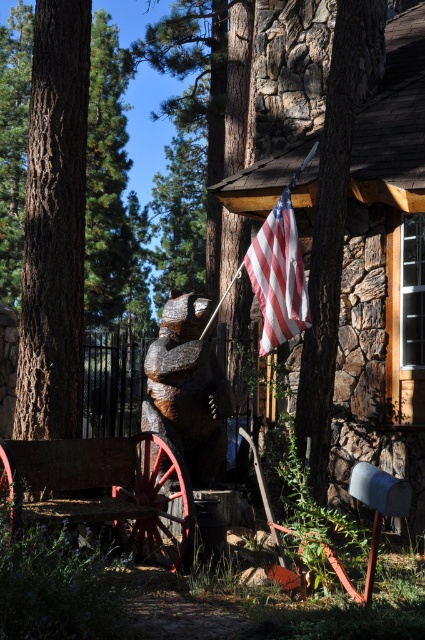
Which of these two, rustic wood wagon at center or wooden bear at center, stands taller?

With more height is wooden bear at center.

Is rustic wood wagon at center shorter than wooden bear at center?

Yes.

This screenshot has height=640, width=425. I want to click on rustic wood wagon at center, so click(x=112, y=490).

Which is above, stone cabin at upper right or rustic wood wagon at center?

Positioned higher is stone cabin at upper right.

Does stone cabin at upper right come in front of rustic wood wagon at center?

No.

Who is more distant from viewer, (385, 132) or (59, 458)?

Point (385, 132)

At what (x,y) coordinates should I click in order to perform the action: click on stone cabin at upper right. Please return your answer as a coordinate pair (x, y). The width and height of the screenshot is (425, 640). Looking at the image, I should click on (385, 282).

Is stone cabin at upper right taller than american flag at upper center?

No.

Which is above, stone cabin at upper right or american flag at upper center?

stone cabin at upper right is higher up.

Which is behind, point (280, 81) or point (297, 323)?

The point (280, 81) is behind.

Where is `stone cabin at upper right`? stone cabin at upper right is located at coordinates (385, 282).